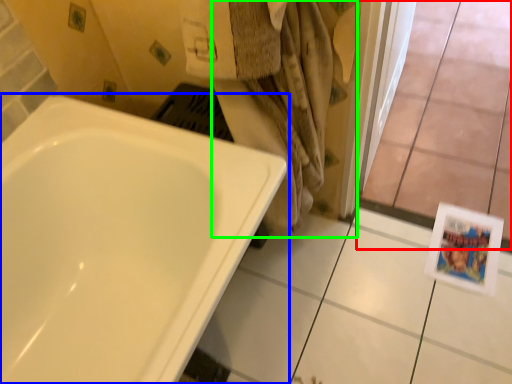
Question: Estimate the real-world distances between objects in this image. Which object is farther from glass door (highlighted by a red box), bathtub (highlighted by a blue box) or bath towel (highlighted by a green box)?

Choices:
 (A) bathtub
 (B) bath towel

Answer: (A)